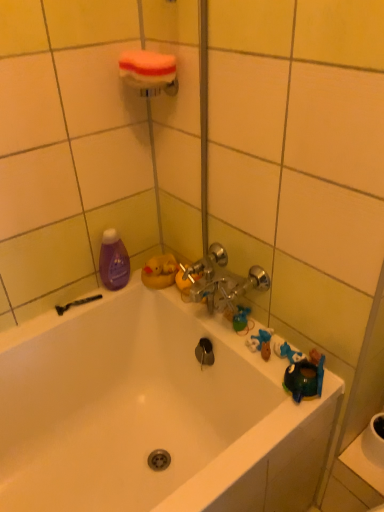
Identify the location of vacant space positioned to the left of purple glossy bottle at left. (71, 307).